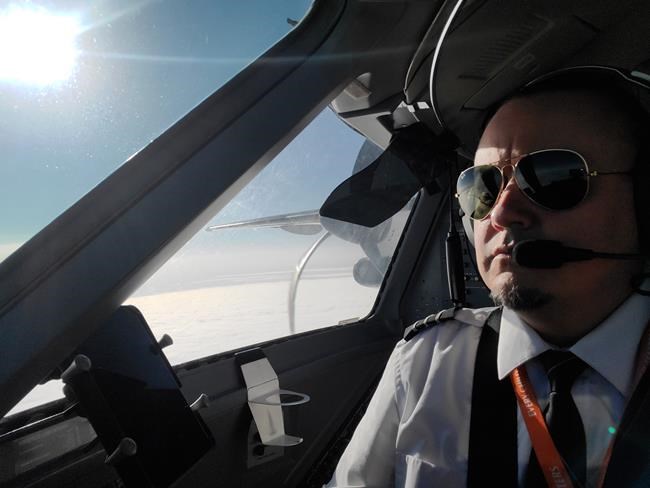
This screenshot has width=650, height=488. I want to click on digital screen, so click(107, 377).